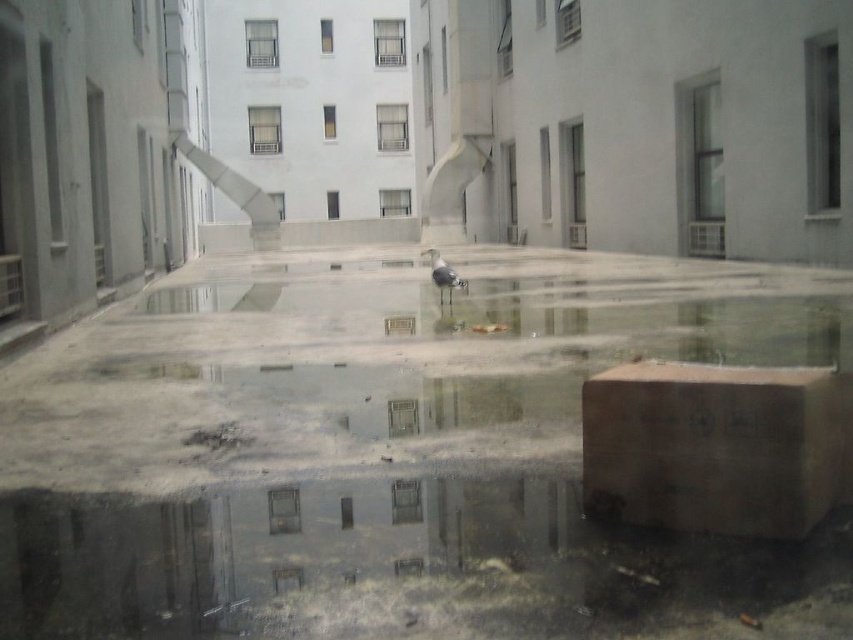
Question: Does clear concrete water at center appear on the right side of brown cardboard box at lower right?

Choices:
 (A) yes
 (B) no

Answer: (B)

Question: Can you confirm if clear concrete water at center is thinner than brown cardboard box at lower right?

Choices:
 (A) yes
 (B) no

Answer: (B)

Question: Considering the relative positions of clear concrete water at center and brown cardboard box at lower right in the image provided, where is clear concrete water at center located with respect to brown cardboard box at lower right?

Choices:
 (A) left
 (B) right

Answer: (A)

Question: Which point appears farthest from the camera in this image?

Choices:
 (A) (318, 476)
 (B) (680, 376)

Answer: (A)